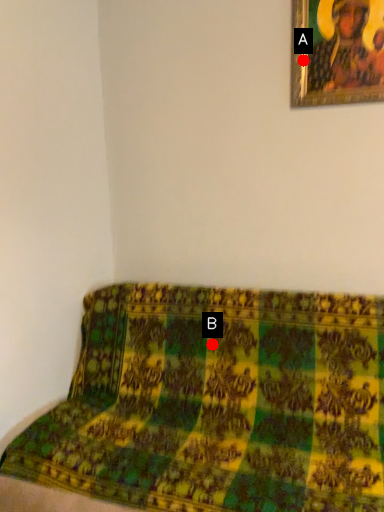
Question: Two points are circled on the image, labeled by A and B beside each circle. Among these points, which one is nearest to the camera?

Choices:
 (A) A is closer
 (B) B is closer

Answer: (A)